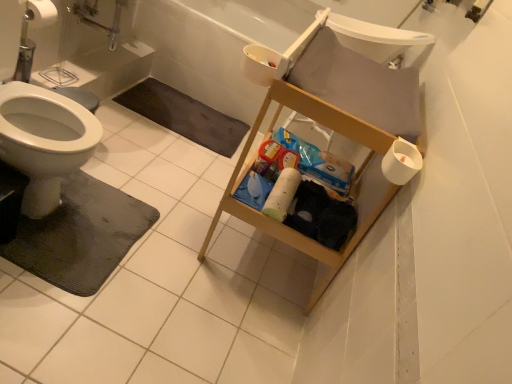
Locate an element on the screen. vacant space that's between black rubber bath mat at lower left, which ranks as the second bath mat in back-to-front order, and black rubber bath mat at lower left, acting as the 2th bath mat starting from the bottom is located at coordinates (151, 159).